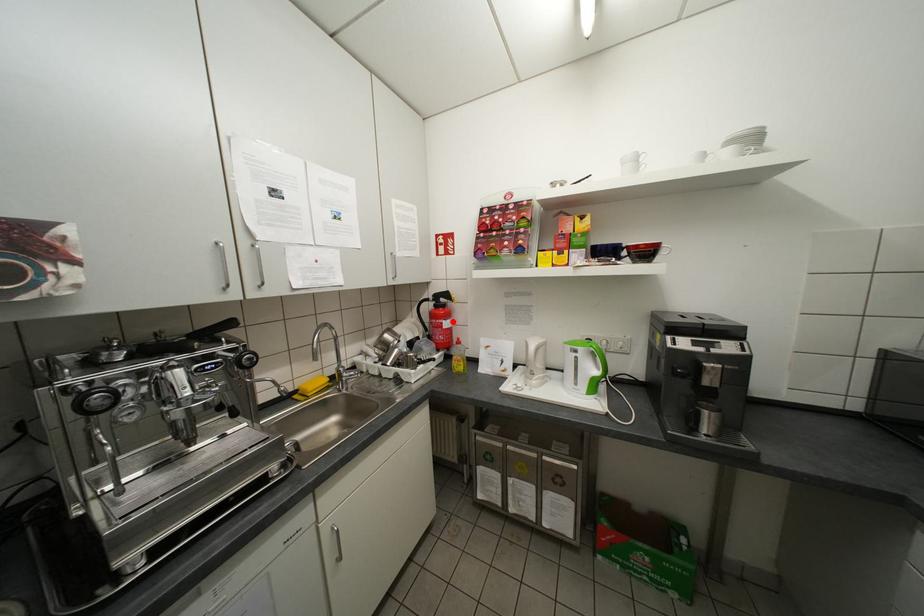
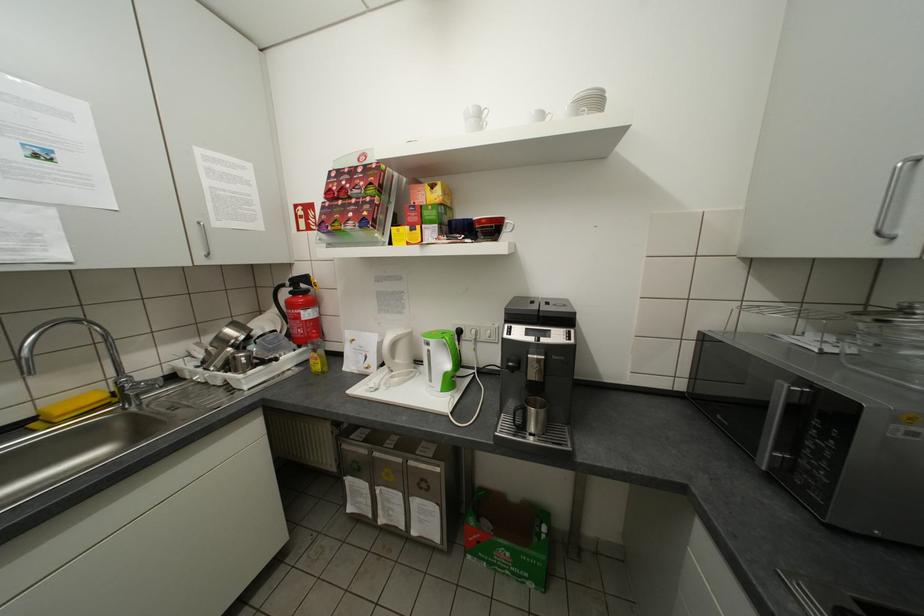
The point at the highlighted location is marked in the first image. Where is the corresponding point in the second image?

(310, 312)